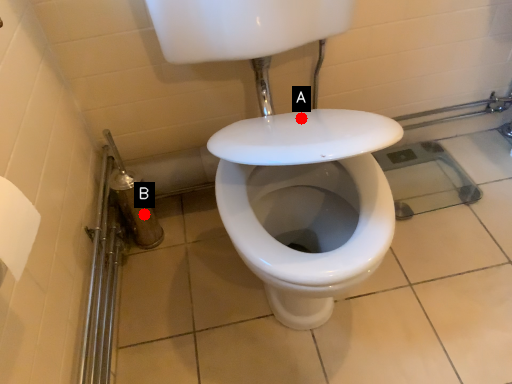
Question: Two points are circled on the image, labeled by A and B beside each circle. Which point is closer to the camera?

Choices:
 (A) A is closer
 (B) B is closer

Answer: (A)